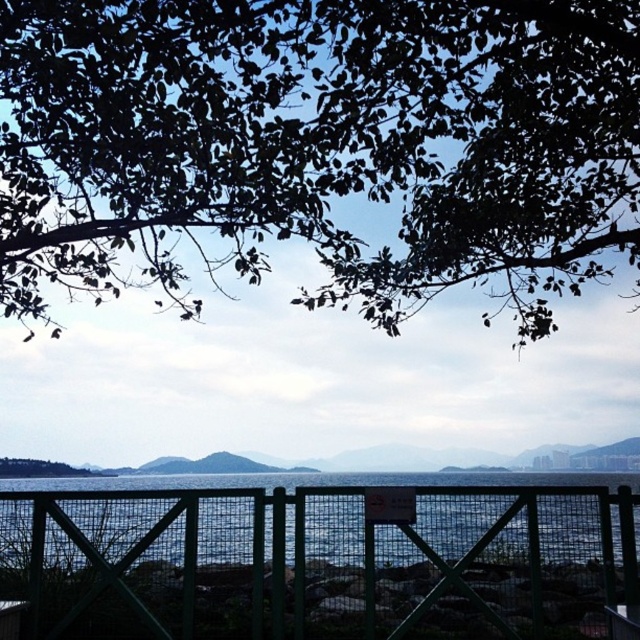
Question: Does green leafy tree at upper center appear over green metal fence at lower center?

Choices:
 (A) yes
 (B) no

Answer: (A)

Question: Among these objects, which one is farthest from the camera?

Choices:
 (A) green metal fence at lower center
 (B) green leafy tree at upper center

Answer: (A)

Question: Is green leafy tree at upper center further to camera compared to green metal fence at lower center?

Choices:
 (A) no
 (B) yes

Answer: (A)

Question: Is green leafy tree at upper center wider than green metal fence at lower center?

Choices:
 (A) yes
 (B) no

Answer: (B)